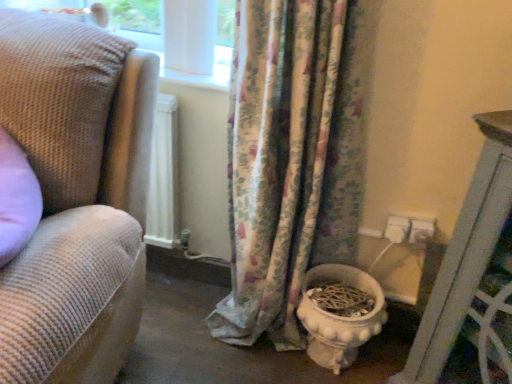
Question: Relative to woven fabric couch at left, is white glossy toilet bowl at lower center in front or behind?

Choices:
 (A) behind
 (B) front

Answer: (A)

Question: Is white glossy toilet bowl at lower center situated inside woven fabric couch at left or outside?

Choices:
 (A) inside
 (B) outside

Answer: (B)

Question: Which object is the farthest from the woven fabric couch at left?

Choices:
 (A) white glossy toilet bowl at lower center
 (B) floral fabric curtain at center

Answer: (A)

Question: Which of these objects is positioned closest to the floral fabric curtain at center?

Choices:
 (A) white glossy toilet bowl at lower center
 (B) woven fabric couch at left

Answer: (A)